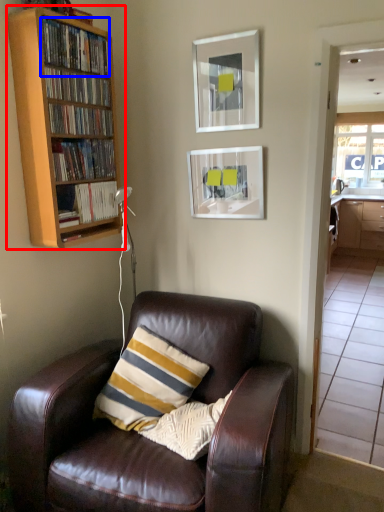
Question: Which object appears closest to the camera in this image, bookcase (highlighted by a red box) or book (highlighted by a blue box)?

Choices:
 (A) bookcase
 (B) book

Answer: (A)